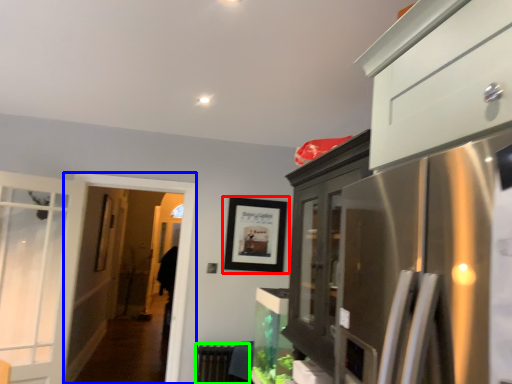
Question: Estimate the real-world distances between objects in this image. Which object is closer to picture frame (highlighted by a red box), screen door (highlighted by a blue box) or radiator (highlighted by a green box)?

Choices:
 (A) screen door
 (B) radiator

Answer: (A)